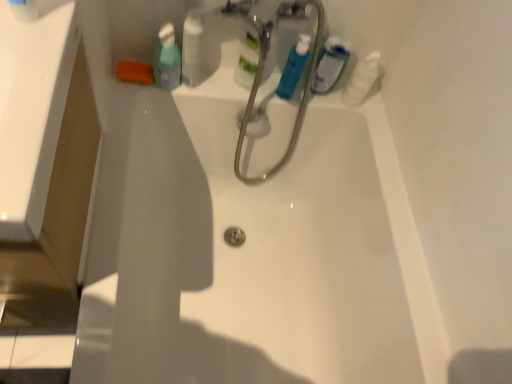
In order to click on white glossy bottle at upper center in this screenshot , I will do (192, 50).

Image resolution: width=512 pixels, height=384 pixels. What do you see at coordinates (330, 64) in the screenshot? I see `translucent plastic mouthwash at upper right, the 3th mouthwash in the left-to-right sequence` at bounding box center [330, 64].

You are a GUI agent. You are given a task and a screenshot of the screen. Output one action in this format:
    pyautogui.click(x=<x>, y=<y>)
    Task: Click on the translucent plastic mouthwash at upper right, the 3th mouthwash in the left-to-right sequence
    The height and width of the screenshot is (384, 512).
    Given the screenshot: What is the action you would take?
    pyautogui.click(x=330, y=64)

Find the location of a particular element. This screenshot has height=384, width=512. white glossy bottle at upper center is located at coordinates (192, 50).

How many degrees apart are the facing directions of white glossy bottle at upper center and blue glossy mouthwash at upper center, which appears as the second mouthwash when viewed from the right?

The facing directions of white glossy bottle at upper center and blue glossy mouthwash at upper center, which appears as the second mouthwash when viewed from the right, are 0.00357 degrees apart.

Which mouthwash is the 1st one when counting from the right side of the white glossy bottle at upper center? Please provide its 2D coordinates.

[(294, 67)]

Looking at this image, is white glossy bottle at upper center aimed at blue glossy mouthwash at upper center, the 2th mouthwash when ordered from left to right?

No, white glossy bottle at upper center is not aimed at blue glossy mouthwash at upper center, the 2th mouthwash when ordered from left to right.

Does blue glossy mouthwash at upper center, the 2th mouthwash when ordered from left to right, have a smaller size compared to translucent plastic mouthwash at upper center, acting as the 1th mouthwash starting from the left?

Yes.

Is blue glossy mouthwash at upper center, which appears as the second mouthwash when viewed from the right, not close to translucent plastic mouthwash at upper center, acting as the 1th mouthwash starting from the left?

blue glossy mouthwash at upper center, which appears as the second mouthwash when viewed from the right, is actually quite close to translucent plastic mouthwash at upper center, acting as the 1th mouthwash starting from the left.

Is blue glossy mouthwash at upper center, the 2th mouthwash when ordered from left to right, taller or shorter than translucent plastic mouthwash at upper center, acting as the 1th mouthwash starting from the left?

In the image, blue glossy mouthwash at upper center, the 2th mouthwash when ordered from left to right, appears to be taller than translucent plastic mouthwash at upper center, acting as the 1th mouthwash starting from the left.

Is blue glossy mouthwash at upper center, which appears as the second mouthwash when viewed from the right, positioned before translucent plastic mouthwash at upper center, placed as the third mouthwash when sorted from right to left?

No.

In the scene shown: Between white glossy bottle at upper right and translucent plastic mouthwash at upper center, acting as the 1th mouthwash starting from the left, which one has smaller width?

Thinner between the two is translucent plastic mouthwash at upper center, acting as the 1th mouthwash starting from the left.

From a real-world perspective, is white glossy bottle at upper right above or below translucent plastic mouthwash at upper center, acting as the 1th mouthwash starting from the left?

white glossy bottle at upper right is below translucent plastic mouthwash at upper center, acting as the 1th mouthwash starting from the left.

Are white glossy bottle at upper right and translucent plastic mouthwash at upper center, placed as the third mouthwash when sorted from right to left, beside each other?

No, white glossy bottle at upper right is not in contact with translucent plastic mouthwash at upper center, placed as the third mouthwash when sorted from right to left.

Between white glossy bottle at upper right and translucent plastic mouthwash at upper center, placed as the third mouthwash when sorted from right to left, which one is positioned behind?

white glossy bottle at upper right is behind.

Would you say blue glossy mouthwash at upper center, the 2th mouthwash when ordered from left to right, contains white glossy bottle at upper right?

That's incorrect, white glossy bottle at upper right is not inside blue glossy mouthwash at upper center, the 2th mouthwash when ordered from left to right.

In terms of width, does blue glossy mouthwash at upper center, the 2th mouthwash when ordered from left to right, look wider or thinner when compared to white glossy bottle at upper right?

Clearly, blue glossy mouthwash at upper center, the 2th mouthwash when ordered from left to right, has less width compared to white glossy bottle at upper right.

From a real-world perspective, is blue glossy mouthwash at upper center, which appears as the second mouthwash when viewed from the right, on top of white glossy bottle at upper right?

Correct, in the physical world, blue glossy mouthwash at upper center, which appears as the second mouthwash when viewed from the right, is higher than white glossy bottle at upper right.

Which is behind, point (331, 73) or point (362, 75)?

The point (362, 75) is behind.

Can you tell me how much translucent plastic mouthwash at upper right, which appears as the 1th mouthwash when viewed from the right, and white glossy bottle at upper right differ in facing direction?

The angular difference between translucent plastic mouthwash at upper right, which appears as the 1th mouthwash when viewed from the right, and white glossy bottle at upper right is 0.00862 degrees.

Considering the sizes of objects translucent plastic mouthwash at upper right, which appears as the 1th mouthwash when viewed from the right, and white glossy bottle at upper right in the image provided, who is thinner, translucent plastic mouthwash at upper right, which appears as the 1th mouthwash when viewed from the right, or white glossy bottle at upper right?

With smaller width is translucent plastic mouthwash at upper right, which appears as the 1th mouthwash when viewed from the right.

Consider the image. Looking at the image, does translucent plastic mouthwash at upper right, the 3th mouthwash in the left-to-right sequence, seem bigger or smaller compared to white glossy bottle at upper right?

translucent plastic mouthwash at upper right, the 3th mouthwash in the left-to-right sequence, is smaller than white glossy bottle at upper right.

From a real-world perspective, which is physically above, blue glossy mouthwash at upper center, which appears as the second mouthwash when viewed from the right, or white glossy bottle at upper center?

white glossy bottle at upper center, from a real-world perspective.

Is blue glossy mouthwash at upper center, the 2th mouthwash when ordered from left to right, outside of white glossy bottle at upper center?

blue glossy mouthwash at upper center, the 2th mouthwash when ordered from left to right, is positioned outside white glossy bottle at upper center.

Which of these two, blue glossy mouthwash at upper center, the 2th mouthwash when ordered from left to right, or white glossy bottle at upper center, is bigger?

With larger size is white glossy bottle at upper center.

Could you tell me if blue glossy mouthwash at upper center, the 2th mouthwash when ordered from left to right, is facing white glossy bottle at upper center?

No, blue glossy mouthwash at upper center, the 2th mouthwash when ordered from left to right, does not turn towards white glossy bottle at upper center.

Is translucent plastic mouthwash at upper right, the 3th mouthwash in the left-to-right sequence, not close to blue glossy mouthwash at upper center, the 2th mouthwash when ordered from left to right?

No, translucent plastic mouthwash at upper right, the 3th mouthwash in the left-to-right sequence, is in close proximity to blue glossy mouthwash at upper center, the 2th mouthwash when ordered from left to right.

Is translucent plastic mouthwash at upper right, which appears as the 1th mouthwash when viewed from the right, further to the viewer compared to blue glossy mouthwash at upper center, the 2th mouthwash when ordered from left to right?

Yes, translucent plastic mouthwash at upper right, which appears as the 1th mouthwash when viewed from the right, is behind blue glossy mouthwash at upper center, the 2th mouthwash when ordered from left to right.

This screenshot has width=512, height=384. Find the location of `mouthwash that is the 1st one when counting rightward from the white glossy bottle at upper center`. mouthwash that is the 1st one when counting rightward from the white glossy bottle at upper center is located at coordinates (294, 67).

From the image's perspective, which mouthwash is the 2nd one below the translucent plastic mouthwash at upper center, placed as the third mouthwash when sorted from right to left? Please provide its 2D coordinates.

[(294, 67)]

Looking at the image, which one is located closer to white glossy bottle at upper center, white glossy bottle at upper right or translucent plastic mouthwash at upper center, acting as the 1th mouthwash starting from the left?

translucent plastic mouthwash at upper center, acting as the 1th mouthwash starting from the left, lies closer to white glossy bottle at upper center than the other object.

Looking at the image, which one is located further to translucent plastic mouthwash at upper center, placed as the third mouthwash when sorted from right to left, white glossy bottle at upper right or translucent plastic mouthwash at upper right, the 3th mouthwash in the left-to-right sequence?

white glossy bottle at upper right is further to translucent plastic mouthwash at upper center, placed as the third mouthwash when sorted from right to left.

Looking at the image, which one is located closer to translucent plastic mouthwash at upper right, which appears as the 1th mouthwash when viewed from the right, blue glossy mouthwash at upper center, the 2th mouthwash when ordered from left to right, or translucent plastic mouthwash at upper center, placed as the third mouthwash when sorted from right to left?

Based on the image, blue glossy mouthwash at upper center, the 2th mouthwash when ordered from left to right, appears to be nearer to translucent plastic mouthwash at upper right, which appears as the 1th mouthwash when viewed from the right.

Looking at the image, which one is located closer to white glossy bottle at upper center, translucent plastic mouthwash at upper right, which appears as the 1th mouthwash when viewed from the right, or white glossy bottle at upper right?

translucent plastic mouthwash at upper right, which appears as the 1th mouthwash when viewed from the right, lies closer to white glossy bottle at upper center than the other object.

Based on their spatial positions, is blue glossy mouthwash at upper center, the 2th mouthwash when ordered from left to right, or white glossy bottle at upper right further from translucent plastic mouthwash at upper right, which appears as the 1th mouthwash when viewed from the right?

blue glossy mouthwash at upper center, the 2th mouthwash when ordered from left to right, is positioned further to the anchor translucent plastic mouthwash at upper right, which appears as the 1th mouthwash when viewed from the right.

Which object lies further to the anchor point white glossy bottle at upper right, translucent plastic mouthwash at upper right, the 3th mouthwash in the left-to-right sequence, or translucent plastic mouthwash at upper center, placed as the third mouthwash when sorted from right to left?

Based on the image, translucent plastic mouthwash at upper center, placed as the third mouthwash when sorted from right to left, appears to be further to white glossy bottle at upper right.

Looking at the image, which one is located closer to translucent plastic mouthwash at upper right, which appears as the 1th mouthwash when viewed from the right, white glossy bottle at upper center or blue glossy mouthwash at upper center, the 2th mouthwash when ordered from left to right?

blue glossy mouthwash at upper center, the 2th mouthwash when ordered from left to right, lies closer to translucent plastic mouthwash at upper right, which appears as the 1th mouthwash when viewed from the right, than the other object.

Which object lies nearer to the anchor point blue glossy mouthwash at upper center, the 2th mouthwash when ordered from left to right, white glossy bottle at upper center or translucent plastic mouthwash at upper right, which appears as the 1th mouthwash when viewed from the right?

translucent plastic mouthwash at upper right, which appears as the 1th mouthwash when viewed from the right, is positioned closer to the anchor blue glossy mouthwash at upper center, the 2th mouthwash when ordered from left to right.

This screenshot has width=512, height=384. I want to click on mouthwash between blue glossy mouthwash at upper center, which appears as the second mouthwash when viewed from the right, and white glossy bottle at upper right, so click(x=330, y=64).

Find the location of `toiletry located between translucent plastic mouthwash at upper center, acting as the 1th mouthwash starting from the left, and translucent plastic mouthwash at upper right, which appears as the 1th mouthwash when viewed from the right, in the left-right direction`. toiletry located between translucent plastic mouthwash at upper center, acting as the 1th mouthwash starting from the left, and translucent plastic mouthwash at upper right, which appears as the 1th mouthwash when viewed from the right, in the left-right direction is located at coordinates (192, 50).

You are a GUI agent. You are given a task and a screenshot of the screen. Output one action in this format:
    pyautogui.click(x=<x>, y=<y>)
    Task: Click on the toiletry situated between translucent plastic mouthwash at upper center, placed as the third mouthwash when sorted from right to left, and blue glossy mouthwash at upper center, which appears as the second mouthwash when viewed from the right, from left to right
    
    Given the screenshot: What is the action you would take?
    pyautogui.click(x=192, y=50)

Identify the location of mouthwash between white glossy bottle at upper center and translucent plastic mouthwash at upper right, which appears as the 1th mouthwash when viewed from the right. (294, 67).